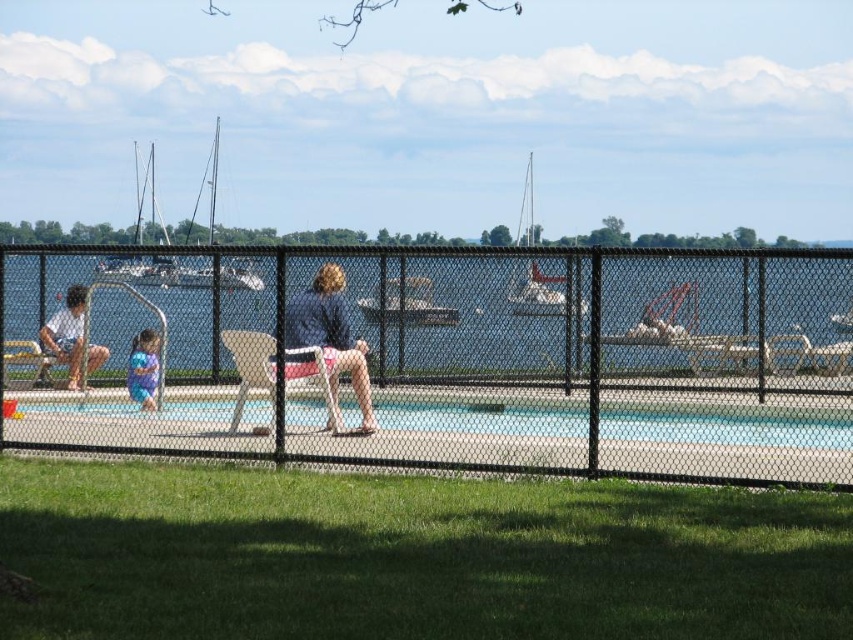
Question: Is matte white shorts at left closer to the viewer compared to matte purple swimsuit at left?

Choices:
 (A) no
 (B) yes

Answer: (A)

Question: Does light brown leather shorts at center have a larger size compared to white glossy boat at center?

Choices:
 (A) no
 (B) yes

Answer: (B)

Question: Which point is closer to the camera?

Choices:
 (A) matte purple swimsuit at left
 (B) blue smooth pool at center
 (C) light brown leather shorts at center

Answer: (C)

Question: Which point appears closest to the camera in this image?

Choices:
 (A) (299, 365)
 (B) (140, 344)

Answer: (A)

Question: Which point appears farthest from the camera in this image?

Choices:
 (A) (607, 444)
 (B) (421, 307)
 (C) (328, 310)

Answer: (C)

Question: Is white glossy boat at center below matte white shorts at left?

Choices:
 (A) no
 (B) yes

Answer: (A)